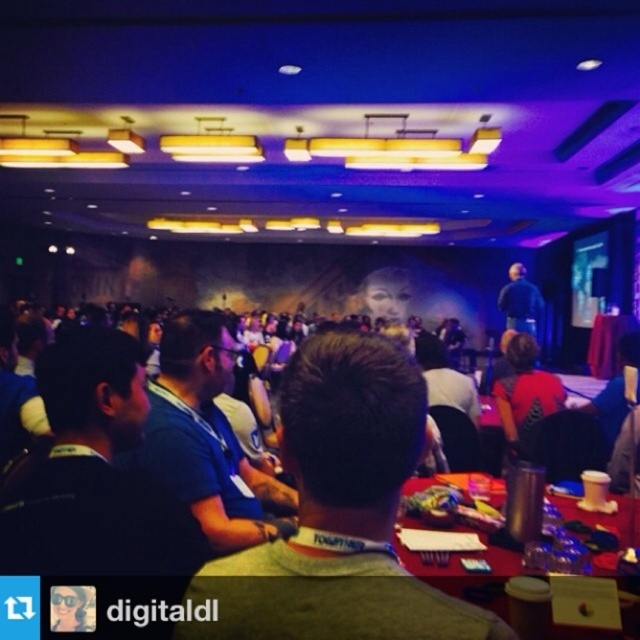
Question: Which of these objects is positioned closest to the red plastic table at lower right?

Choices:
 (A) white fabric lanyard at center
 (B) dark blue shirt at center

Answer: (A)

Question: Considering the relative positions of white fabric lanyard at center and dark blue shirt at center in the image provided, where is white fabric lanyard at center located with respect to dark blue shirt at center?

Choices:
 (A) right
 (B) left

Answer: (B)

Question: Estimate the real-world distances between objects in this image. Which object is farther from the white fabric lanyard at center?

Choices:
 (A) dark blue shirt at center
 (B) red plastic table at lower right

Answer: (A)

Question: Can you confirm if red plastic table at lower right is positioned above dark blue shirt at center?

Choices:
 (A) yes
 (B) no

Answer: (B)

Question: Which of the following is the farthest from the observer?

Choices:
 (A) (483, 532)
 (B) (292, 595)

Answer: (A)

Question: Can you confirm if white fabric lanyard at center is positioned to the left of dark blue shirt at center?

Choices:
 (A) yes
 (B) no

Answer: (A)